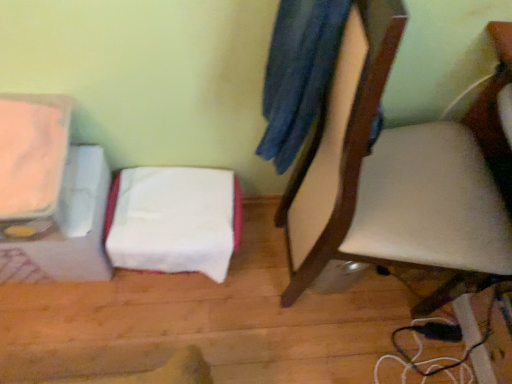
Locate an element on the screen. free space above white fabric at lower left (from a real-world perspective) is located at coordinates (181, 209).